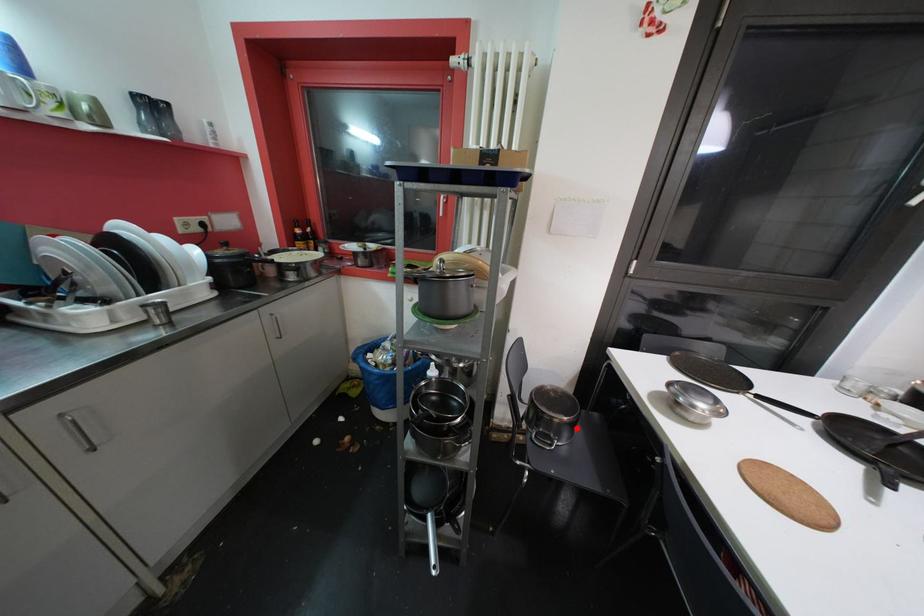
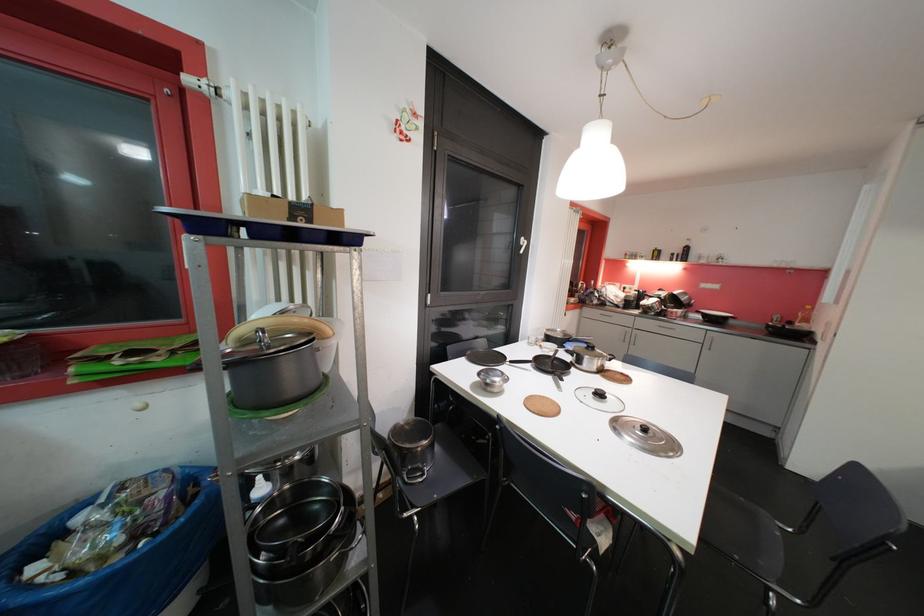
In the second image, find the point that corresponds to the highlighted location in the first image.

(436, 447)